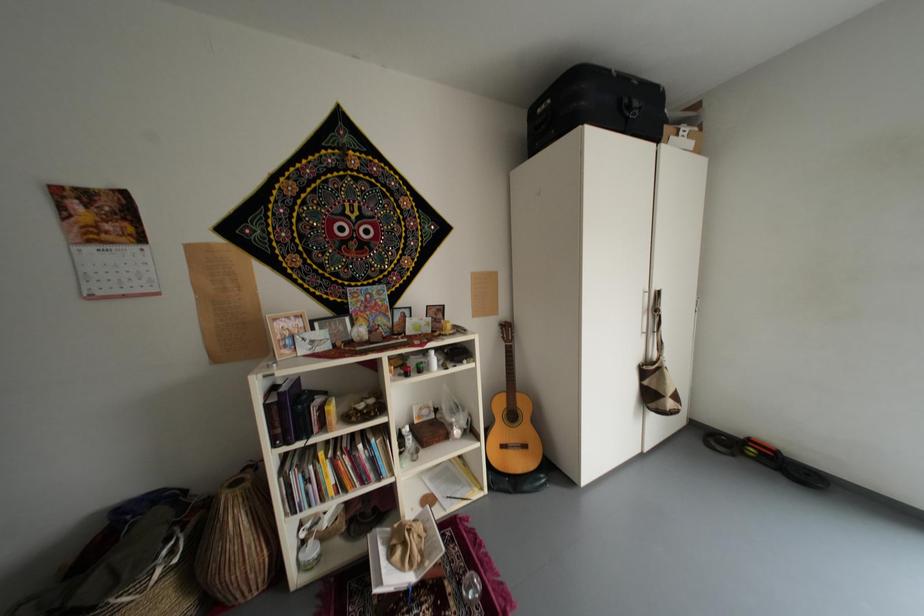
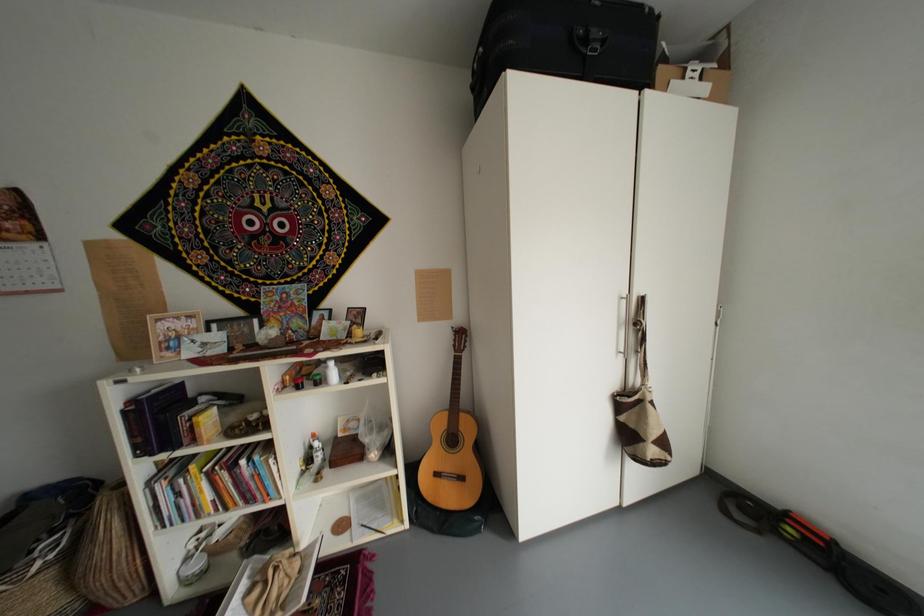
The images are taken continuously from a first-person perspective. In which direction are you moving?

The cameraman walked toward right, forward.